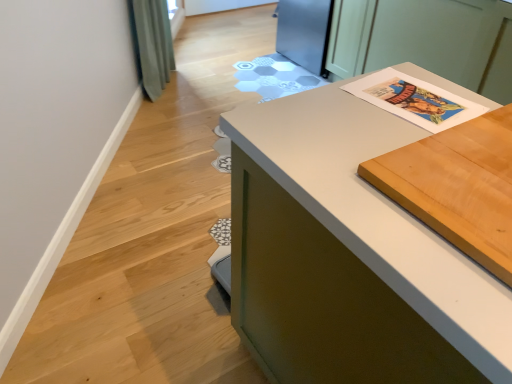
Question: Can you confirm if white paper at upper right is shorter than white matte countertop at center?

Choices:
 (A) no
 (B) yes

Answer: (B)

Question: Would you say white paper at upper right contains white matte countertop at center?

Choices:
 (A) yes
 (B) no

Answer: (B)

Question: Is white paper at upper right to the left of white matte countertop at center from the viewer's perspective?

Choices:
 (A) yes
 (B) no

Answer: (B)

Question: Considering the relative positions of white paper at upper right and white matte countertop at center in the image provided, is white paper at upper right behind white matte countertop at center?

Choices:
 (A) no
 (B) yes

Answer: (B)

Question: Is white paper at upper right closer to the viewer compared to white matte countertop at center?

Choices:
 (A) no
 (B) yes

Answer: (A)

Question: Does white paper at upper right touch white matte countertop at center?

Choices:
 (A) no
 (B) yes

Answer: (A)

Question: Is white matte countertop at center positioned behind light brown wood cutting board at upper right?

Choices:
 (A) no
 (B) yes

Answer: (B)

Question: Would you say white matte countertop at center is a long distance from light brown wood cutting board at upper right?

Choices:
 (A) no
 (B) yes

Answer: (A)

Question: From a real-world perspective, is white matte countertop at center on light brown wood cutting board at upper right?

Choices:
 (A) no
 (B) yes

Answer: (A)

Question: From the image's perspective, would you say white matte countertop at center is shown under light brown wood cutting board at upper right?

Choices:
 (A) no
 (B) yes

Answer: (B)

Question: Is white matte countertop at center oriented towards light brown wood cutting board at upper right?

Choices:
 (A) no
 (B) yes

Answer: (A)

Question: Can you confirm if white matte countertop at center is taller than light brown wood cutting board at upper right?

Choices:
 (A) no
 (B) yes

Answer: (B)

Question: Is light brown wood cutting board at upper right aimed at white matte countertop at center?

Choices:
 (A) no
 (B) yes

Answer: (B)